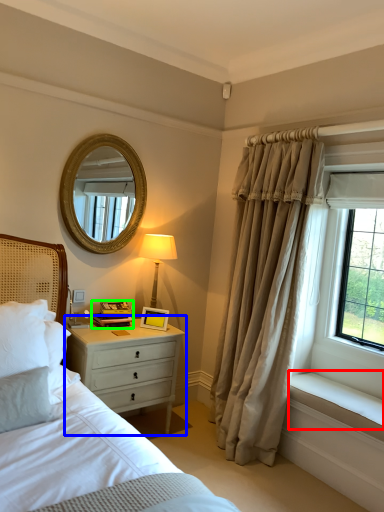
Question: Estimate the real-world distances between objects in this image. Which object is closer to window sill (highlighted by a red box), nightstand (highlighted by a blue box) or book (highlighted by a green box)?

Choices:
 (A) nightstand
 (B) book

Answer: (A)